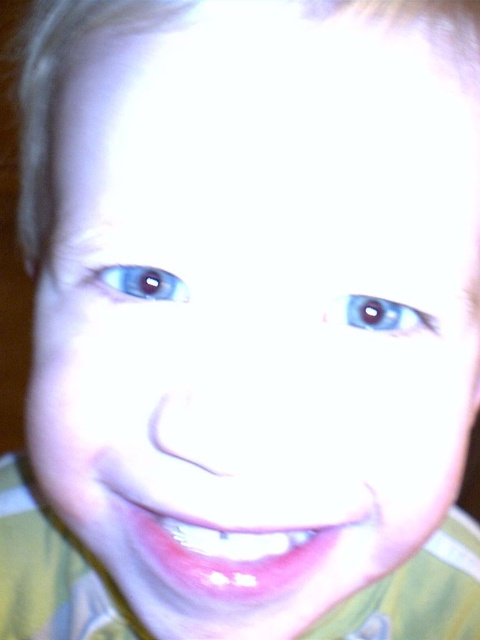
Question: Is pink glossy teeth at center closer to camera compared to blue glossy eye at center?

Choices:
 (A) no
 (B) yes

Answer: (B)

Question: Does pink glossy teeth at center appear over blue glossy eye at upper left?

Choices:
 (A) no
 (B) yes

Answer: (A)

Question: Which point is farther from the camera taking this photo?

Choices:
 (A) (410, 314)
 (B) (132, 266)
 (C) (330, 561)

Answer: (C)

Question: In this image, where is pink glossy teeth at center located relative to blue glossy eye at upper left?

Choices:
 (A) above
 (B) below

Answer: (B)

Question: Estimate the real-world distances between objects in this image. Which object is closer to the blue glossy eye at center?

Choices:
 (A) blue glossy eye at upper left
 (B) pink glossy teeth at center

Answer: (A)

Question: Which point is farther to the camera?

Choices:
 (A) (333, 545)
 (B) (421, 317)
 (C) (112, 276)

Answer: (A)